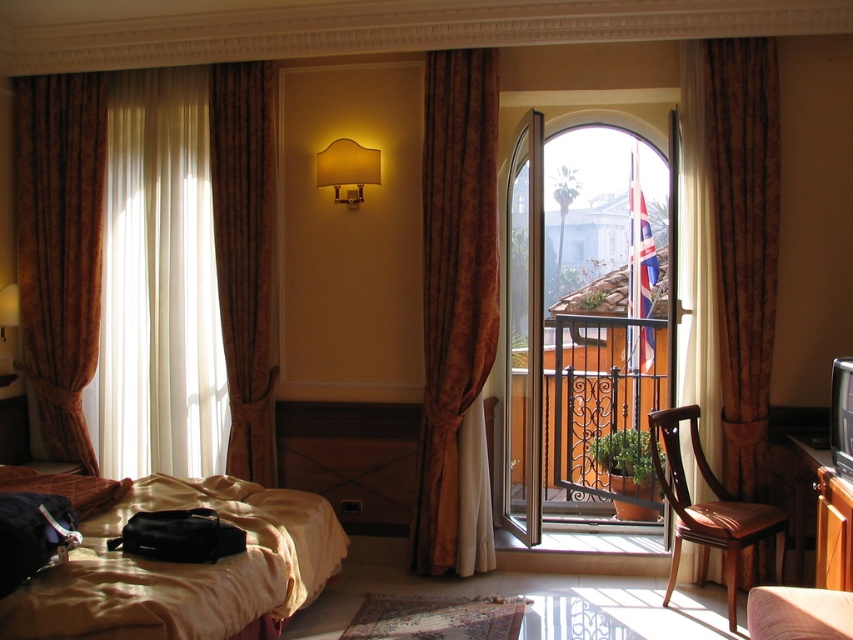
Question: Does gold textured curtain at left have a larger size compared to brown wooden chair at right?

Choices:
 (A) no
 (B) yes

Answer: (A)

Question: Is gold damask curtain at center behind brown textured curtain at left?

Choices:
 (A) yes
 (B) no

Answer: (B)

Question: Can you confirm if brown wooden chair at right is positioned to the right of transparent glass table at lower center?

Choices:
 (A) no
 (B) yes

Answer: (B)

Question: Which of the following is the farthest from the observer?

Choices:
 (A) (613, 632)
 (B) (238, 412)

Answer: (B)

Question: Among these objects, which one is nearest to the camera?

Choices:
 (A) transparent glass table at lower center
 (B) clear glass door at center
 (C) brown wooden chair at right

Answer: (A)

Question: Which is farther from the transparent glass table at lower center?

Choices:
 (A) gold damask curtain at center
 (B) satin gold bed at lower left

Answer: (B)